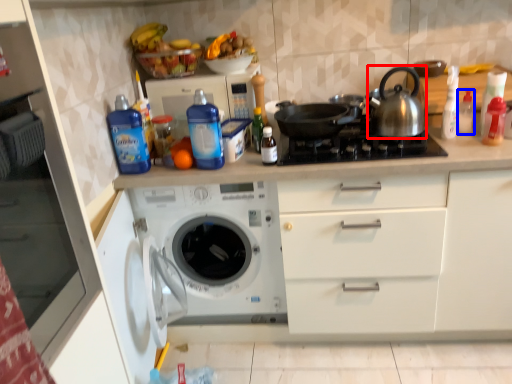
Question: Which of the following is the closest to the observer, tea pot (highlighted by a red box) or bottle (highlighted by a blue box)?

Choices:
 (A) tea pot
 (B) bottle

Answer: (A)